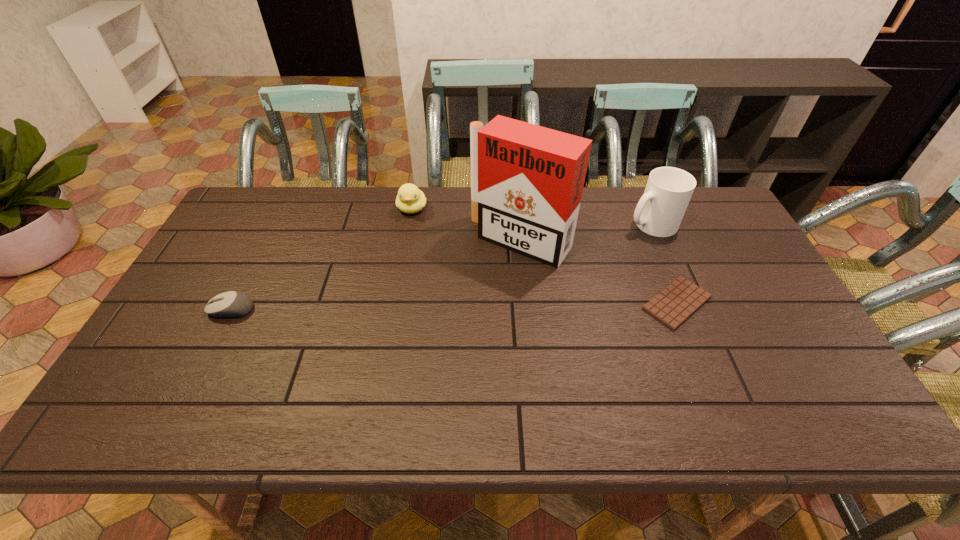
Locate an element on the screen. Image resolution: width=960 pixels, height=540 pixels. duckling located at the far edge is located at coordinates (410, 199).

Locate an element on the screen. This screenshot has width=960, height=540. mug located in the far edge section of the desktop is located at coordinates (659, 212).

Where is `object that is at the left edge`? The image size is (960, 540). object that is at the left edge is located at coordinates (231, 304).

The height and width of the screenshot is (540, 960). In the image, there is a desktop. What are the coordinates of `vacant space at the near edge` in the screenshot? It's located at (689, 382).

You are a GUI agent. You are given a task and a screenshot of the screen. Output one action in this format:
    pyautogui.click(x=<x>, y=<y>)
    Task: Click on the blank space at the left edge
    Image resolution: width=960 pixels, height=540 pixels.
    Given the screenshot: What is the action you would take?
    pyautogui.click(x=244, y=245)

Where is `free space at the near right corner`? This screenshot has width=960, height=540. free space at the near right corner is located at coordinates (776, 368).

Find the location of a particular element. Image resolution: width=960 pixels, height=540 pixels. empty location between the fourth object from right to left and the cigarette case is located at coordinates [x=467, y=225].

Locate an element on the screen. vacant space that's between the second object from left to right and the cigarette case is located at coordinates (467, 225).

Image resolution: width=960 pixels, height=540 pixels. Find the location of `vacant area that lies between the cigarette case and the computer equipment`. vacant area that lies between the cigarette case and the computer equipment is located at coordinates (376, 275).

The width and height of the screenshot is (960, 540). I want to click on free space between the computer equipment and the chocolate bar, so click(x=454, y=306).